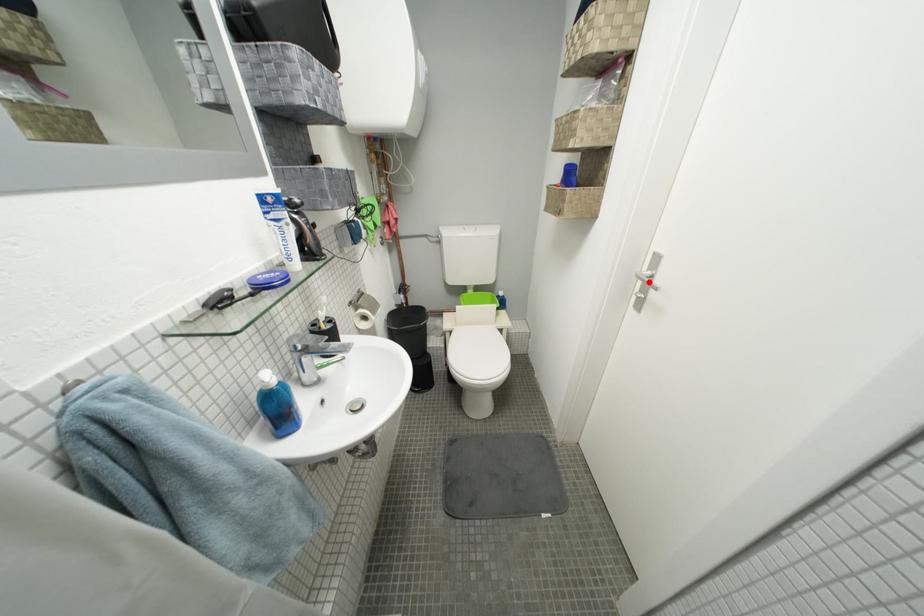
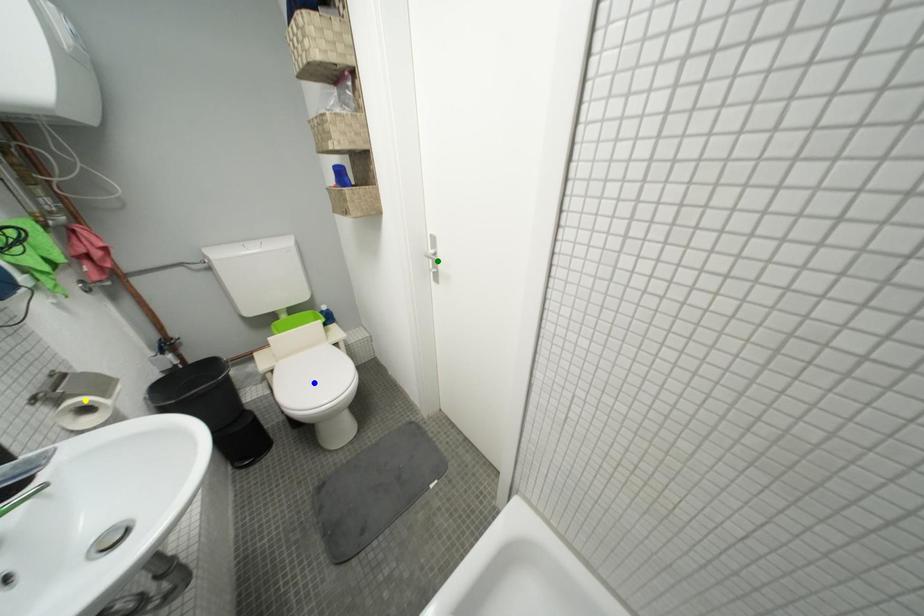
Question: I am providing you with two images of the same scene from different viewpoints. A red point is marked on the first image. You are given multiple points on the second image. Can you choose the point in image 2 that corresponds to the point in image 1?

Choices:
 (A) blue point
 (B) green point
 (C) yellow point

Answer: (B)